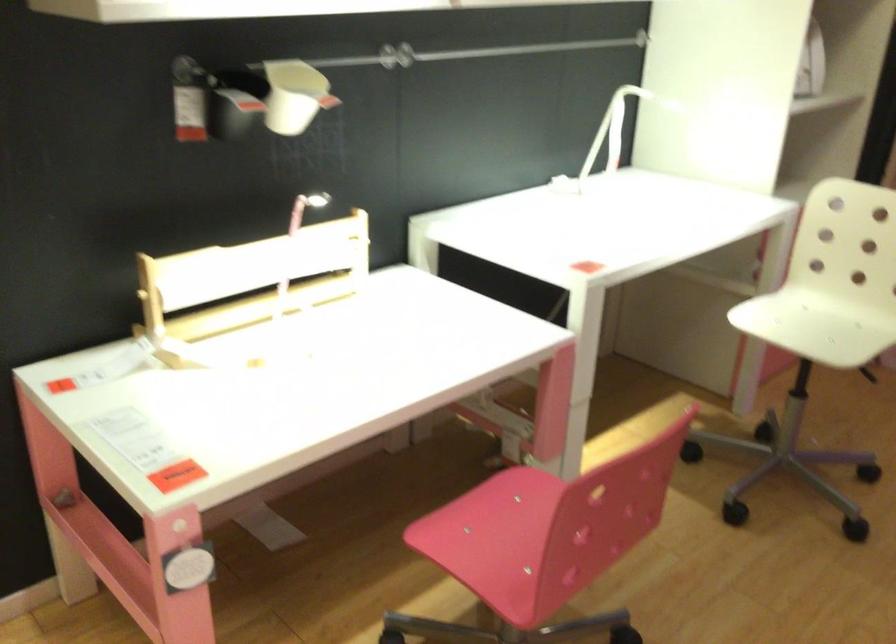
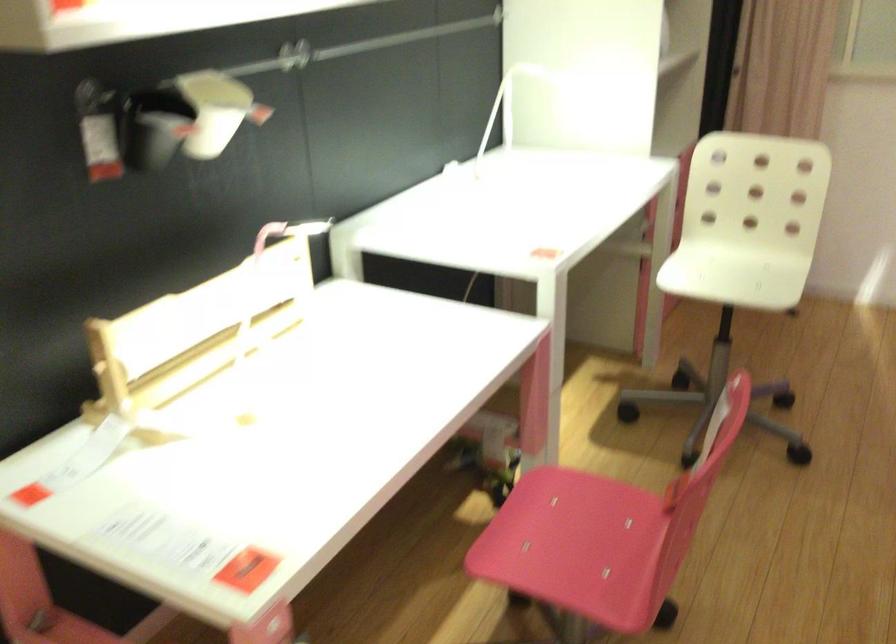
Question: The camera is either moving clockwise (left) or counter-clockwise (right) around the object. The first image is from the beginning of the video and the second image is from the end. Is the camera moving left or right when shooting the video?

Choices:
 (A) Left
 (B) Right

Answer: (A)